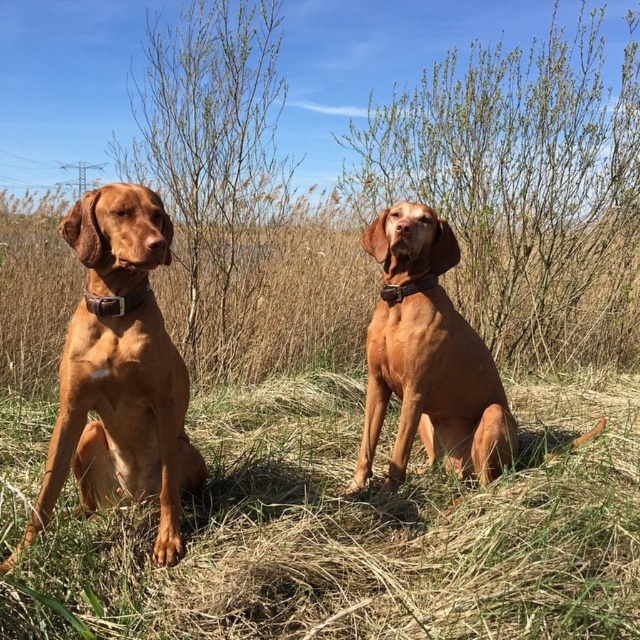
Who is lower down, brown leather collar at left or brown leather collar at center?

brown leather collar at left is below.

Is brown leather collar at left closer to camera compared to brown leather collar at center?

That is True.

Which is in front, point (90, 292) or point (396, 294)?

Point (90, 292) is in front.

At what (x,y) coordinates should I click in order to perform the action: click on brown leather collar at left. Please return your answer as a coordinate pair (x, y). Looking at the image, I should click on (115, 301).

Between brown leather dog at left and brown leather collar at left, which one appears on the right side from the viewer's perspective?

brown leather collar at left

Is brown leather dog at left positioned at the back of brown leather collar at left?

No, brown leather dog at left is in front of brown leather collar at left.

Is point (108, 284) less distant than point (145, 285)?

Yes, point (108, 284) is in front of point (145, 285).

Locate an element on the screen. Image resolution: width=640 pixels, height=640 pixels. brown leather dog at left is located at coordinates (122, 420).

Is brown grass at center positioned at the back of brown leather collar at left?

No, it is in front of brown leather collar at left.

Between point (337, 384) and point (90, 292), which one is positioned behind?

Point (337, 384)

Locate an element on the screen. This screenshot has width=640, height=640. brown grass at center is located at coordinates (362, 532).